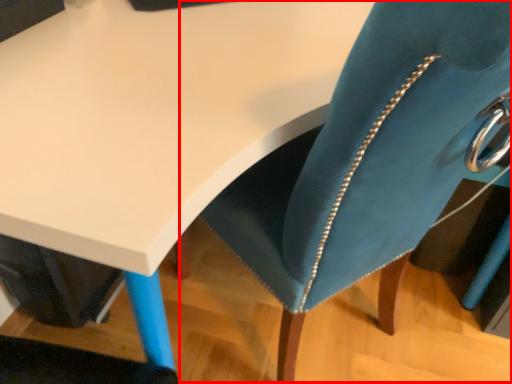
Question: From the image's perspective, what is the correct spatial positioning of swivel chair (annotated by the red box) in reference to table?

Choices:
 (A) above
 (B) below

Answer: (B)